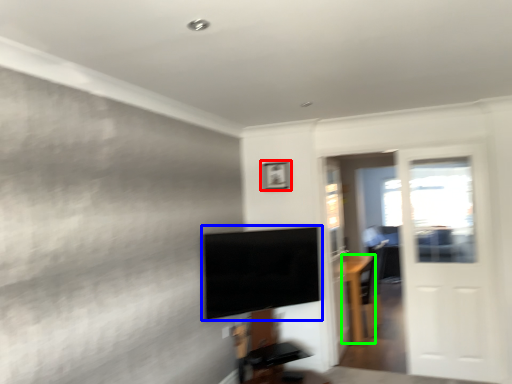
Question: Which object is the closest to the picture frame (highlighted by a red box)? Choose among these: television (highlighted by a blue box) or furniture (highlighted by a green box).

Choices:
 (A) television
 (B) furniture

Answer: (A)